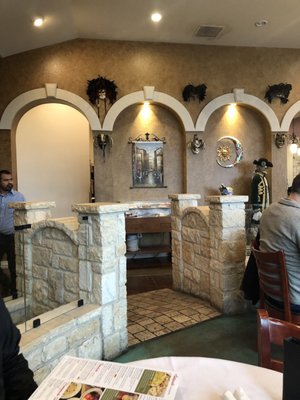
Identify the location of light that isnt on in ceiling. (260, 24).